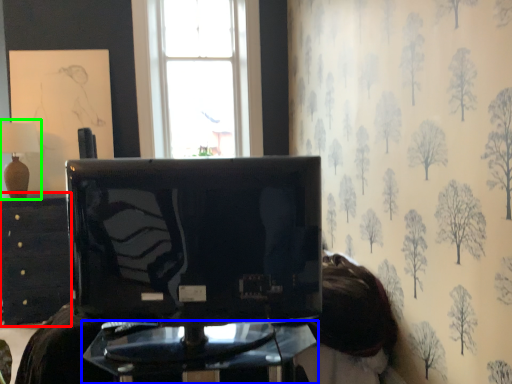
Question: Which is nearer to the furniture (highlighted by a red box)? furniture (highlighted by a blue box) or table lamp (highlighted by a green box).

Choices:
 (A) furniture
 (B) table lamp

Answer: (B)